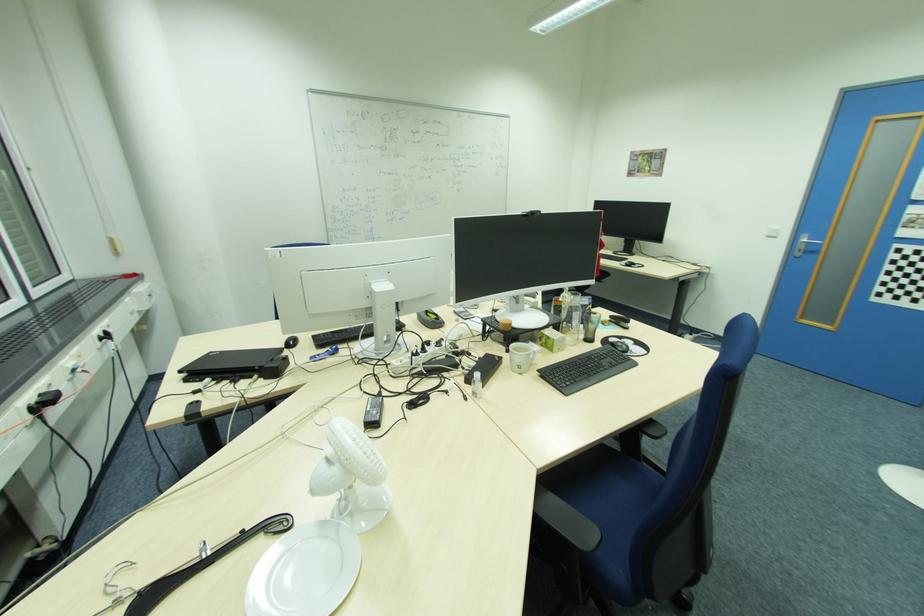
Find the location of `closed black laptop`. closed black laptop is located at coordinates (229, 361).